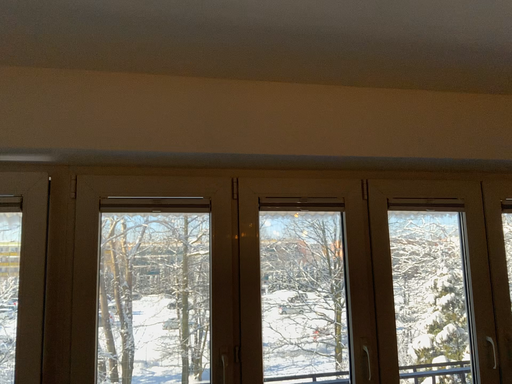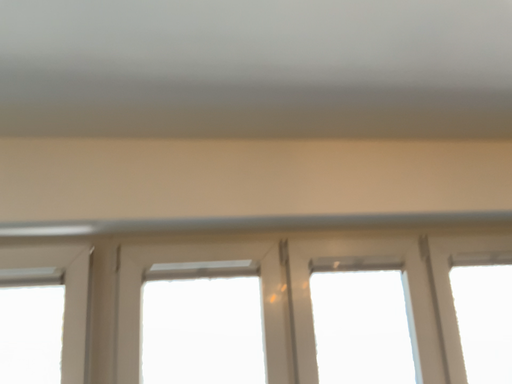
Question: How did the camera likely rotate when shooting the video?

Choices:
 (A) rotated downward
 (B) rotated upward

Answer: (B)